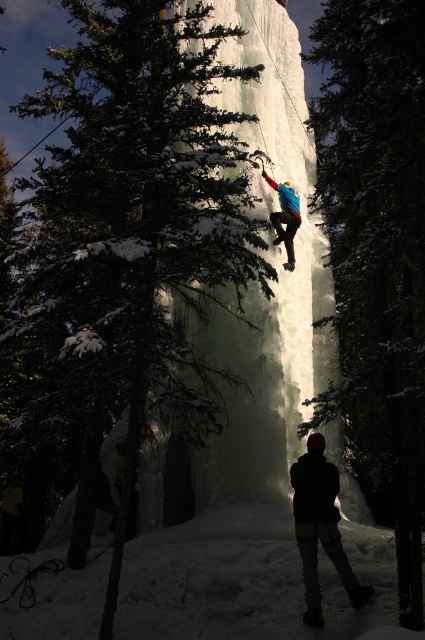
Is dark fabric jacket at lower center below blue fabric snowboarder at center?

Yes, dark fabric jacket at lower center is below blue fabric snowboarder at center.

Image resolution: width=425 pixels, height=640 pixels. Describe the element at coordinates (320, 528) in the screenshot. I see `dark fabric jacket at lower center` at that location.

Image resolution: width=425 pixels, height=640 pixels. What do you see at coordinates (320, 528) in the screenshot? I see `dark fabric jacket at lower center` at bounding box center [320, 528].

You are a GUI agent. You are given a task and a screenshot of the screen. Output one action in this format:
    pyautogui.click(x=<x>, y=<y>)
    Task: Click on the dark fabric jacket at lower center
    This screenshot has width=425, height=640.
    Given the screenshot: What is the action you would take?
    pyautogui.click(x=320, y=528)

Who is more distant from viewer, (201, 433) or (292, 195)?

The point (292, 195) is more distant.

Is the position of green snow-covered tree at center less distant than that of blue fabric snowboarder at center?

Yes, it is in front of blue fabric snowboarder at center.

Between point (101, 237) and point (289, 264), which one is positioned in front?

Point (101, 237) is more forward.

The height and width of the screenshot is (640, 425). I want to click on green snow-covered tree at center, so click(135, 218).

Based on the photo, is green textured tree at center bigger than blue fabric snowboarder at center?

Indeed, green textured tree at center has a larger size compared to blue fabric snowboarder at center.

Identify the location of green textured tree at center. This screenshot has height=640, width=425. (376, 246).

Identify the location of green textured tree at center. (376, 246).